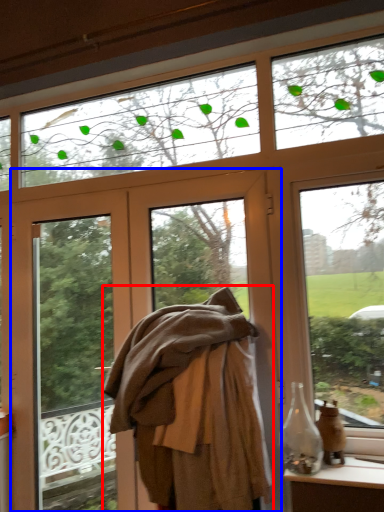
Question: Which of the following is the farthest to the observer, clothing (highlighted by a red box) or door (highlighted by a blue box)?

Choices:
 (A) clothing
 (B) door

Answer: (B)